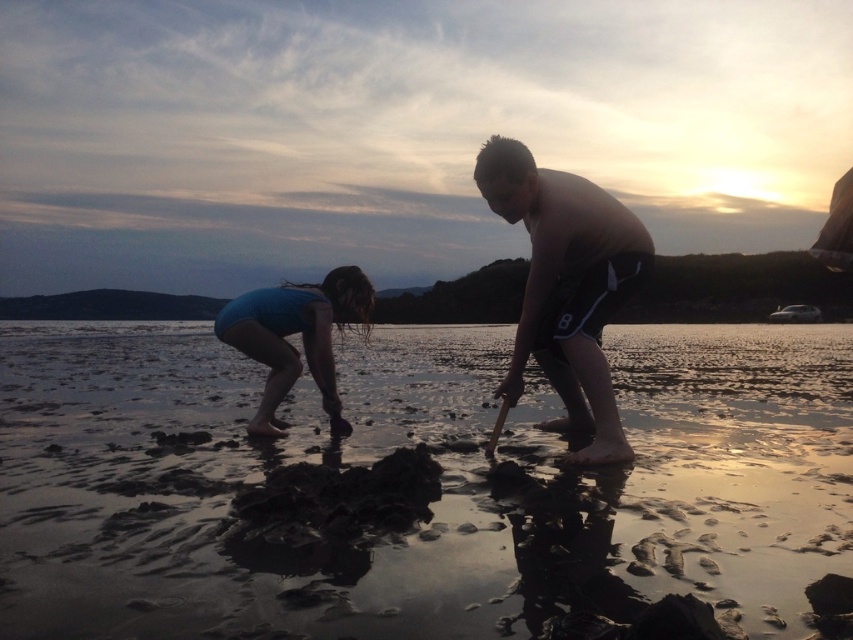
You are a parent watching your children play on the beach. You notice the muddy wet sand at lower center and the shiny black shorts at center. Which object is closer to the horizon?

The shiny black shorts at center are closer to the horizon because the muddy wet sand at lower center is not as tall as the shiny black shorts at center, implying the shorts are further away from the viewer and thus closer to the horizon.

You are a photographer trying to capture the sunset scene. You notice two objects at the center of the image. One is the shiny black shorts at center and the other is the blue fabric at center. Which one is positioned higher in the image?

The shiny black shorts at center is above the blue fabric at center, so the shiny black shorts at center is positioned higher in the image.